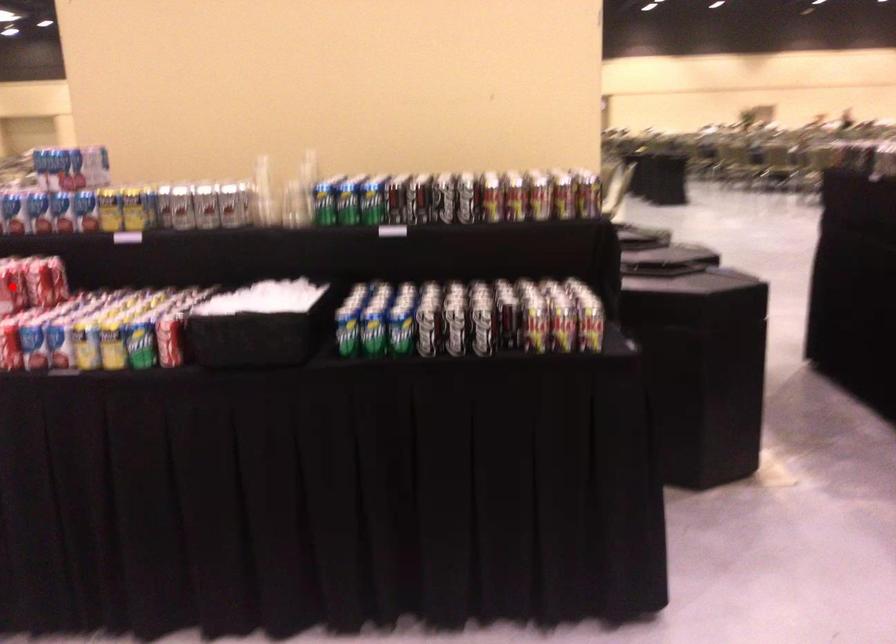
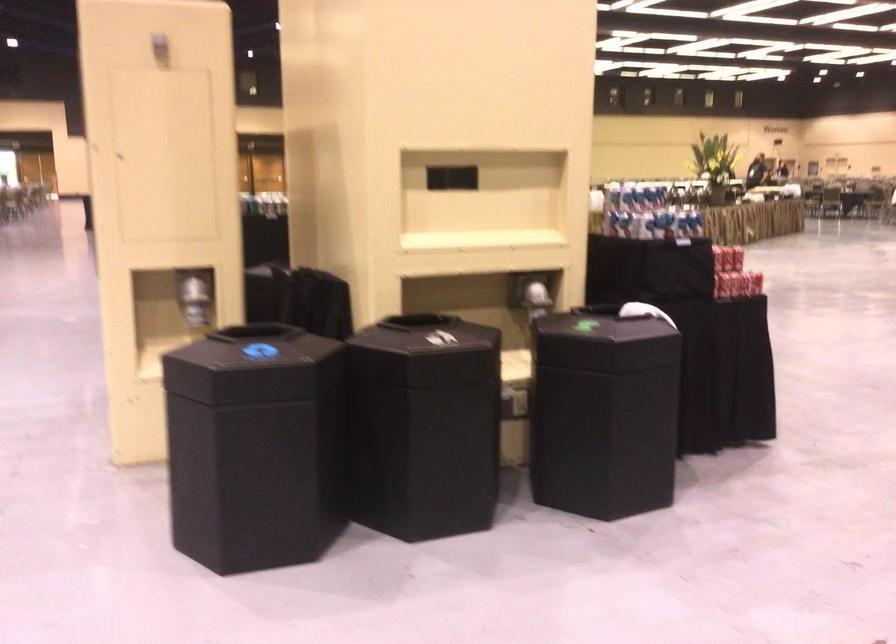
Question: I am providing you with two images of the same scene from different viewpoints. A red point is marked on the first image. Can you still see the location of the red point in image 2?

Choices:
 (A) Yes
 (B) No

Answer: (B)